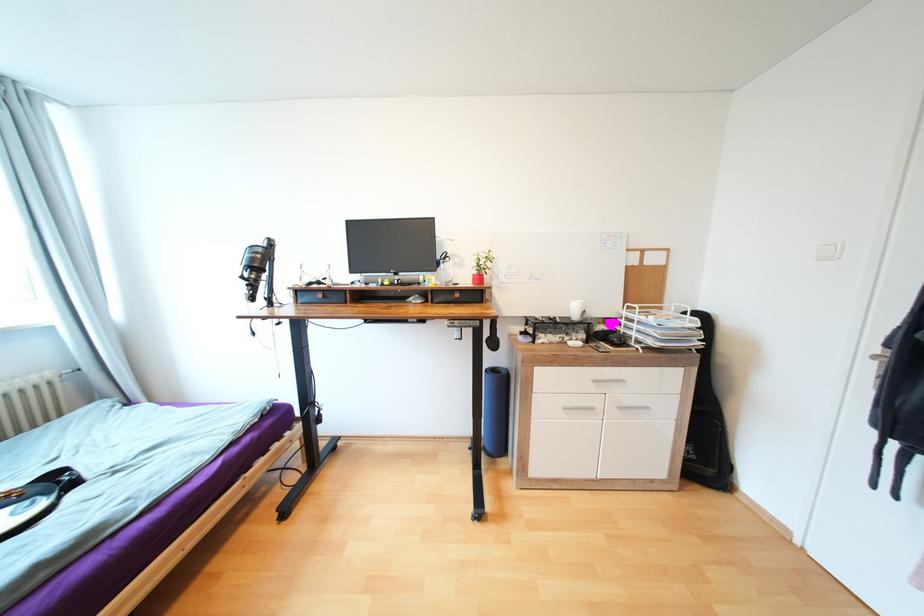
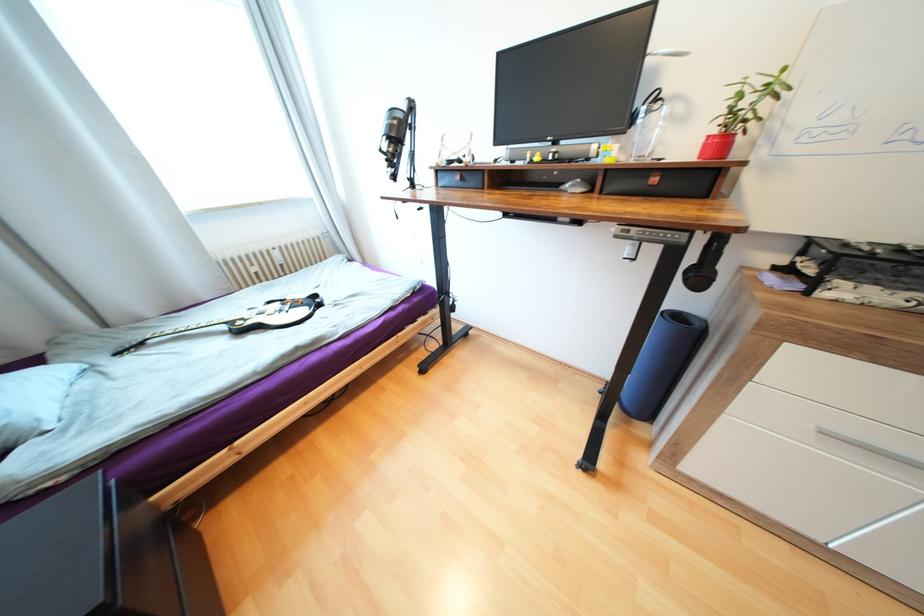
The point at (x=500, y=370) is marked in the first image. Where is the corresponding point in the second image?

(685, 315)